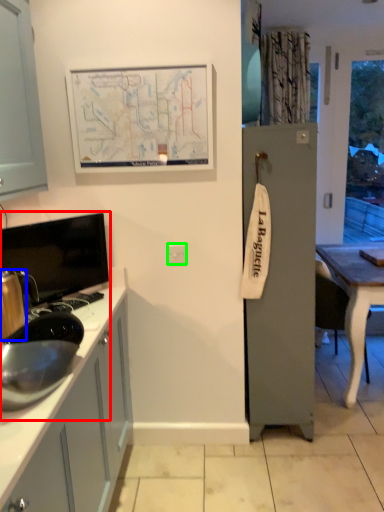
Question: Which object is positioned farthest from sink (highlighted by a red box)? Select from appliance (highlighted by a blue box) and electric outlet (highlighted by a green box).

Choices:
 (A) appliance
 (B) electric outlet

Answer: (B)